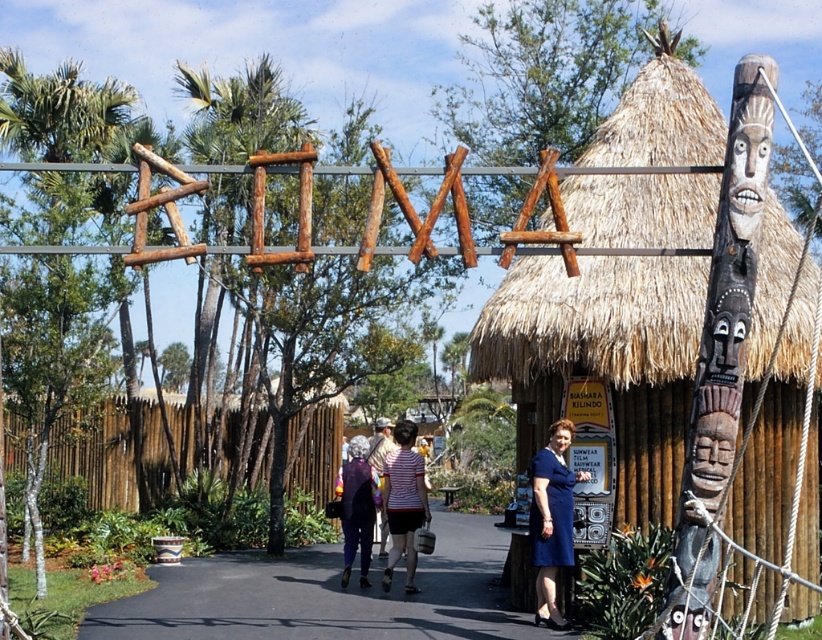
Is thatched straw hut at center wider than blue fabric dress at center?

Correct, the width of thatched straw hut at center exceeds that of blue fabric dress at center.

Between point (656, 96) and point (552, 602), which one is positioned in front?

Positioned in front is point (552, 602).

Where is `thatched straw hut at center`? thatched straw hut at center is located at coordinates (635, 355).

Is thatched straw hut at center further to the viewer compared to green leafy palm tree at left?

Yes, it is behind green leafy palm tree at left.

Is thatched straw hut at center shorter than green leafy palm tree at left?

Yes.

The width and height of the screenshot is (822, 640). Describe the element at coordinates (635, 355) in the screenshot. I see `thatched straw hut at center` at that location.

Locate an element on the screen. Image resolution: width=822 pixels, height=640 pixels. thatched straw hut at center is located at coordinates (635, 355).

Is green leafy palm tree at left bigger than striped cotton shirt at center?

Yes.

Is green leafy palm tree at left to the right of striped cotton shirt at center from the viewer's perspective?

Incorrect, green leafy palm tree at left is not on the right side of striped cotton shirt at center.

Find the location of a particular element. The width and height of the screenshot is (822, 640). green leafy palm tree at left is located at coordinates (243, 112).